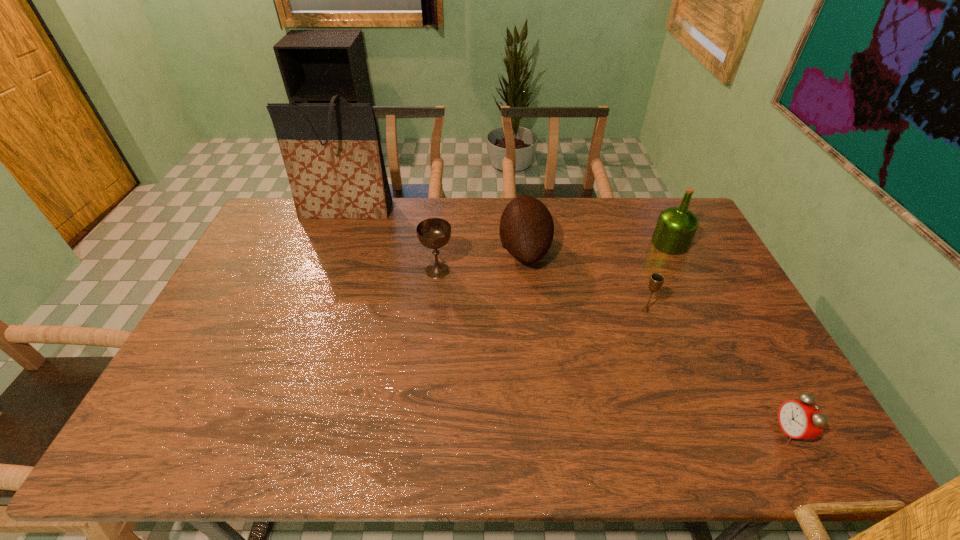
This screenshot has height=540, width=960. I want to click on shopping bag at the far edge, so click(x=332, y=153).

Image resolution: width=960 pixels, height=540 pixels. In order to click on olive oil that is positioned at the far edge in this screenshot , I will do `click(676, 226)`.

This screenshot has width=960, height=540. Find the location of `football present at the far edge`. football present at the far edge is located at coordinates (526, 231).

Locate an element on the screen. This screenshot has width=960, height=540. object located at the near edge is located at coordinates (798, 419).

You are a GUI agent. You are given a task and a screenshot of the screen. Output one action in this format:
    pyautogui.click(x=<x>, y=<y>)
    Task: Click on the object that is positioned at the left edge
    
    Given the screenshot: What is the action you would take?
    pyautogui.click(x=332, y=153)

Locate an element on the screen. This screenshot has height=540, width=960. olive oil that is at the right edge is located at coordinates (676, 226).

Locate an element on the screen. Image resolution: width=960 pixels, height=540 pixels. alarm clock present at the right edge is located at coordinates (798, 419).

Where is `object that is at the far left corner`? object that is at the far left corner is located at coordinates (332, 153).

Image resolution: width=960 pixels, height=540 pixels. I want to click on object present at the far right corner, so click(676, 226).

Find the location of `object present at the near right corner`. object present at the near right corner is located at coordinates (798, 419).